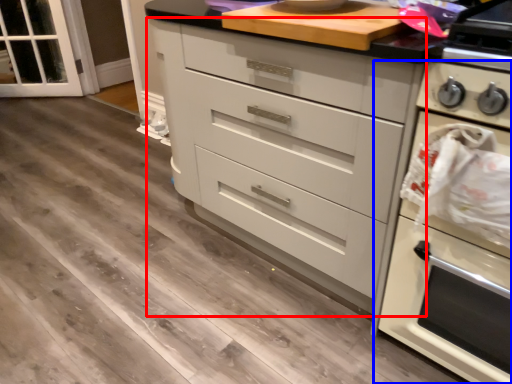
Question: Which of the following is the closest to the observer, chest of drawers (highlighted by a red box) or home appliance (highlighted by a blue box)?

Choices:
 (A) chest of drawers
 (B) home appliance

Answer: (B)